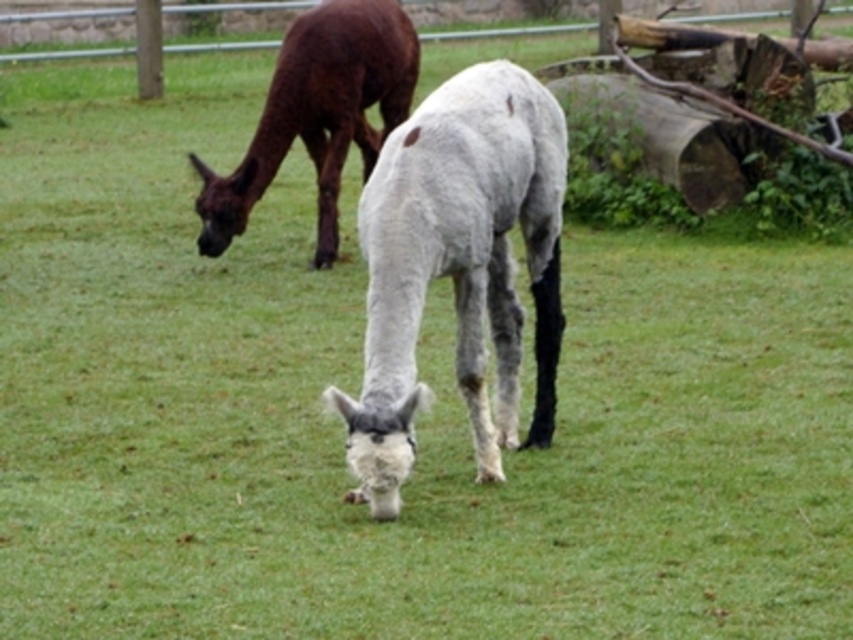
You are a farmer checking on your alpacas in the field. You notice the white woolen alpaca at center and the brown woolen alpaca at upper left. Which alpaca is located to the right of the other?

The white woolen alpaca at center is positioned on the right side of brown woolen alpaca at upper left.

You are a farmer who needs to separate the two alpacas using a temporary fence. The temporary fence you have can only span 10 feet. Based on the image, can you place the fence between the white woolen alpaca at center and the brown woolen alpaca at upper left to separate them?

The distance between the white woolen alpaca at center and the brown woolen alpaca at upper left is 11.86 feet, which is longer than the 10 feet capacity of the temporary fence. Therefore, the fence cannot be placed between them to separate the two alpacas.